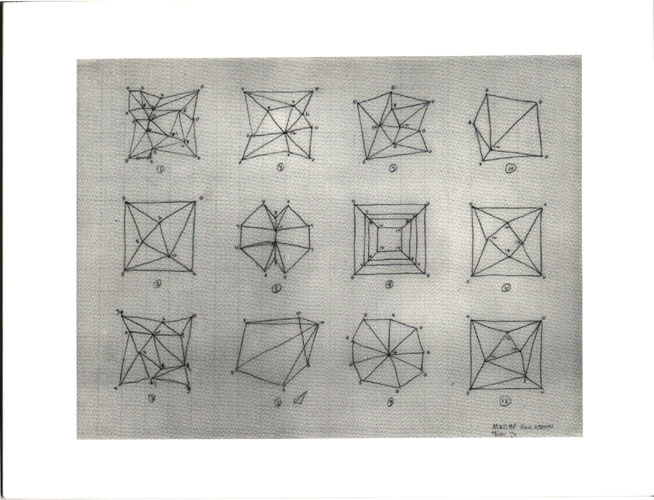
Find the location of a particular element. This screenshot has height=500, width=654. 4 drawings on 2nd row is located at coordinates (161, 241), (278, 246), (375, 246), (511, 247).